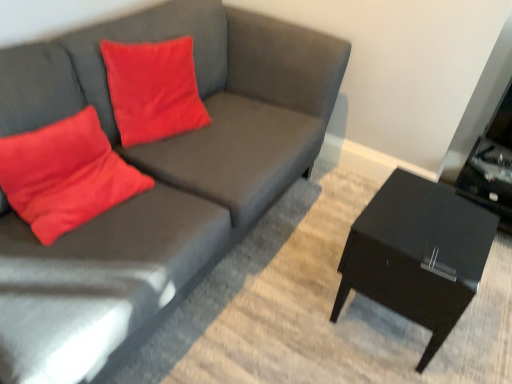
Question: Considering the relative sizes of black glossy side table at right and matte gray couch at center in the image provided, is black glossy side table at right smaller than matte gray couch at center?

Choices:
 (A) no
 (B) yes

Answer: (B)

Question: From a real-world perspective, is black glossy side table at right located beneath matte gray couch at center?

Choices:
 (A) yes
 (B) no

Answer: (A)

Question: Considering the relative sizes of black glossy side table at right and matte gray couch at center in the image provided, is black glossy side table at right thinner than matte gray couch at center?

Choices:
 (A) no
 (B) yes

Answer: (B)

Question: Is black glossy side table at right to the left of matte gray couch at center from the viewer's perspective?

Choices:
 (A) yes
 (B) no

Answer: (B)

Question: From a real-world perspective, is black glossy side table at right positioned over matte gray couch at center based on gravity?

Choices:
 (A) yes
 (B) no

Answer: (B)

Question: From the image's perspective, is black glossy side table at right located beneath matte gray couch at center?

Choices:
 (A) no
 (B) yes

Answer: (B)

Question: From a real-world perspective, is matte red pillow at left located beneath matte gray couch at center?

Choices:
 (A) yes
 (B) no

Answer: (B)

Question: Considering the relative sizes of matte red pillow at left and matte gray couch at center in the image provided, is matte red pillow at left bigger than matte gray couch at center?

Choices:
 (A) yes
 (B) no

Answer: (B)

Question: From the image's perspective, does matte red pillow at left appear lower than matte gray couch at center?

Choices:
 (A) no
 (B) yes

Answer: (B)

Question: Can you confirm if matte red pillow at left is shorter than matte gray couch at center?

Choices:
 (A) no
 (B) yes

Answer: (B)

Question: Is matte red pillow at left thinner than matte gray couch at center?

Choices:
 (A) no
 (B) yes

Answer: (B)

Question: Is there a large distance between matte red pillow at left and matte gray couch at center?

Choices:
 (A) no
 (B) yes

Answer: (A)

Question: Could black glossy side table at right be considered to be inside matte gray couch at center?

Choices:
 (A) no
 (B) yes

Answer: (A)